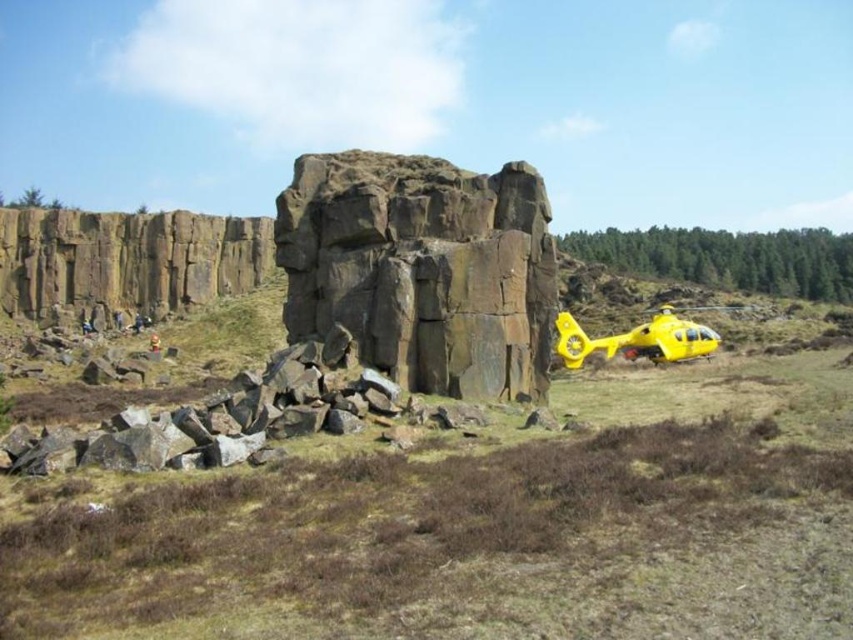
Is yellow plastic helicopter at right taller than dark gray stone rock at center?

No.

Is yellow plastic helicopter at right in front of dark gray stone rock at center?

Yes, yellow plastic helicopter at right is closer to the viewer.

Is point (276, 474) farther from camera compared to point (277, 209)?

No, (276, 474) is closer to viewer.

This screenshot has height=640, width=853. Find the location of `yellow plastic helicopter at right`. yellow plastic helicopter at right is located at coordinates (474, 522).

Image resolution: width=853 pixels, height=640 pixels. What do you see at coordinates (422, 269) in the screenshot?
I see `dark gray stone rock at center` at bounding box center [422, 269].

Which is behind, point (538, 288) or point (663, 321)?

Point (663, 321)

Identify the location of dark gray stone rock at center. This screenshot has width=853, height=640. (422, 269).

Is yellow plastic helicopter at right in front of yellow matte helicopter at right?

Yes, yellow plastic helicopter at right is in front of yellow matte helicopter at right.

This screenshot has height=640, width=853. Identify the location of yellow plastic helicopter at right. (474, 522).

Image resolution: width=853 pixels, height=640 pixels. I want to click on yellow plastic helicopter at right, so click(474, 522).